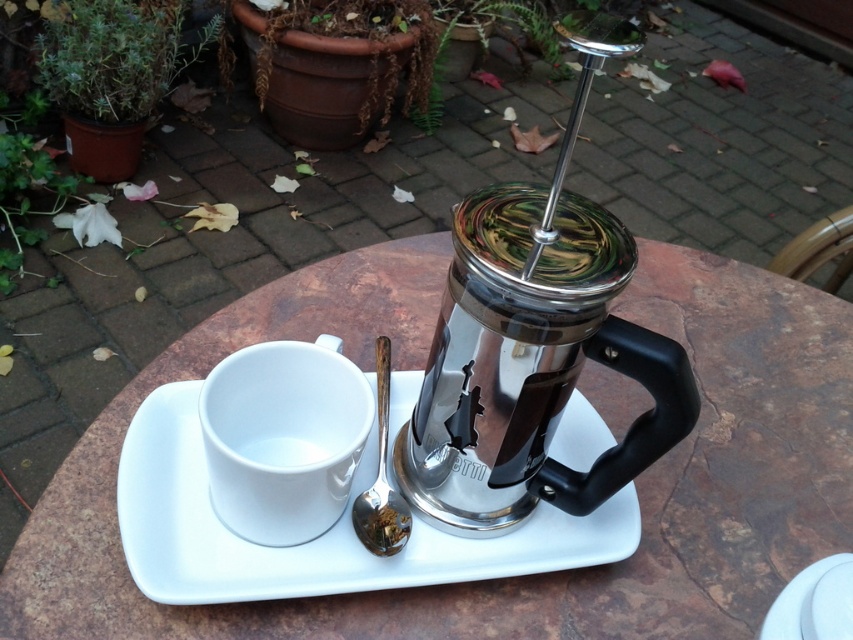
You are holding a spoon that is 6 inches long and want to place it on the white ceramic saucer at center. Can the spoon fit on the saucer without hanging off the edge?

The distance of white ceramic saucer at center from viewer is 16.27 inches. Since the spoon is only 6 inches long, it will easily fit on the saucer without hanging off the edge.

Based on the photo, you are a barista trying to place the satin silver spoon at lower center onto the metallic brown table at center. Will the spoon fit on the table without hanging over the edges?

The metallic brown table at center is taller than satin silver spoon at lower center, so the spoon will fit on the table without hanging over the edges since it is shorter in height.

You have a small cookie that needs to be placed on either the white ceramic saucer at center or the satin silver spoon at lower center. Which object can the cookie fit on without falling off?

The white ceramic saucer at center has a larger width than the satin silver spoon at lower center, so the cookie can fit on the white ceramic saucer at center without falling off.